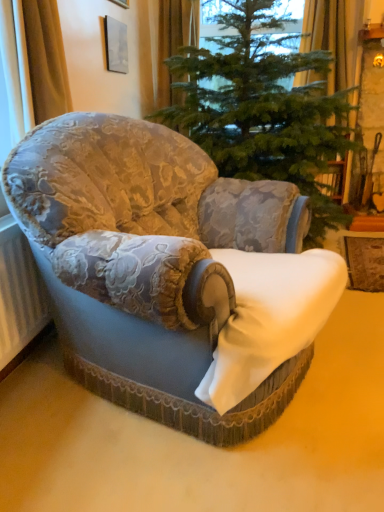
Question: Is white textured radiator at lower left inside gold textured curtain at left, the third curtain from the back?

Choices:
 (A) no
 (B) yes

Answer: (A)

Question: From the image's perspective, is gold textured curtain at left, the 1th curtain in the left-to-right sequence, on top of white textured radiator at lower left?

Choices:
 (A) no
 (B) yes

Answer: (B)

Question: Can you confirm if gold textured curtain at left, the third curtain from the back, is taller than white textured radiator at lower left?

Choices:
 (A) no
 (B) yes

Answer: (A)

Question: Is gold textured curtain at left, the third curtain from the back, to the right of white textured radiator at lower left from the viewer's perspective?

Choices:
 (A) no
 (B) yes

Answer: (B)

Question: Does gold textured curtain at left, the third curtain from the back, turn towards white textured radiator at lower left?

Choices:
 (A) yes
 (B) no

Answer: (B)

Question: From a real-world perspective, is gold textured curtain at left, the 1th curtain in the left-to-right sequence, below white textured radiator at lower left?

Choices:
 (A) yes
 (B) no

Answer: (B)

Question: Is gold textured curtain at left, arranged as the 1th curtain when viewed from the front, behind orange fabric curtain at upper center, positioned as the second curtain in left-to-right order?

Choices:
 (A) no
 (B) yes

Answer: (A)

Question: Is gold textured curtain at left, the third curtain from the back, smaller than orange fabric curtain at upper center, the second curtain from the right?

Choices:
 (A) no
 (B) yes

Answer: (B)

Question: From a real-world perspective, is gold textured curtain at left, which is counted as the third curtain, starting from the right, on orange fabric curtain at upper center, the first curtain positioned from the back?

Choices:
 (A) no
 (B) yes

Answer: (A)

Question: Is gold textured curtain at left, arranged as the 1th curtain when viewed from the front, positioned beyond the bounds of orange fabric curtain at upper center, positioned as the second curtain in left-to-right order?

Choices:
 (A) yes
 (B) no

Answer: (A)

Question: From the image's perspective, would you say gold textured curtain at left, which is counted as the third curtain, starting from the right, is shown under orange fabric curtain at upper center, the second curtain from the right?

Choices:
 (A) no
 (B) yes

Answer: (B)

Question: Is gold textured curtain at left, the 1th curtain in the left-to-right sequence, oriented away from orange fabric curtain at upper center, the first curtain positioned from the back?

Choices:
 (A) yes
 (B) no

Answer: (B)

Question: Does yellow fabric curtain at upper right, the 3th curtain from the left, have a lesser height compared to green textured christmas tree at center?

Choices:
 (A) no
 (B) yes

Answer: (B)